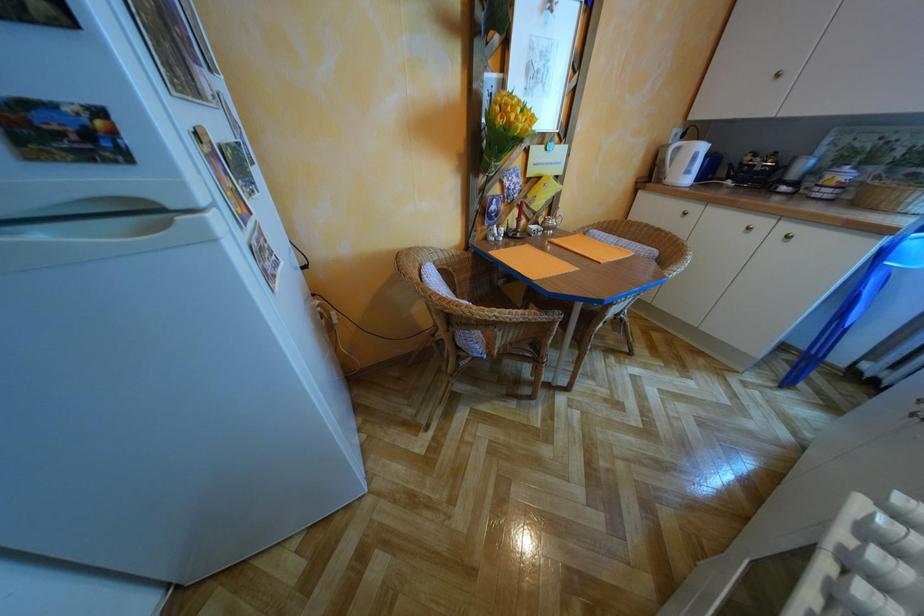
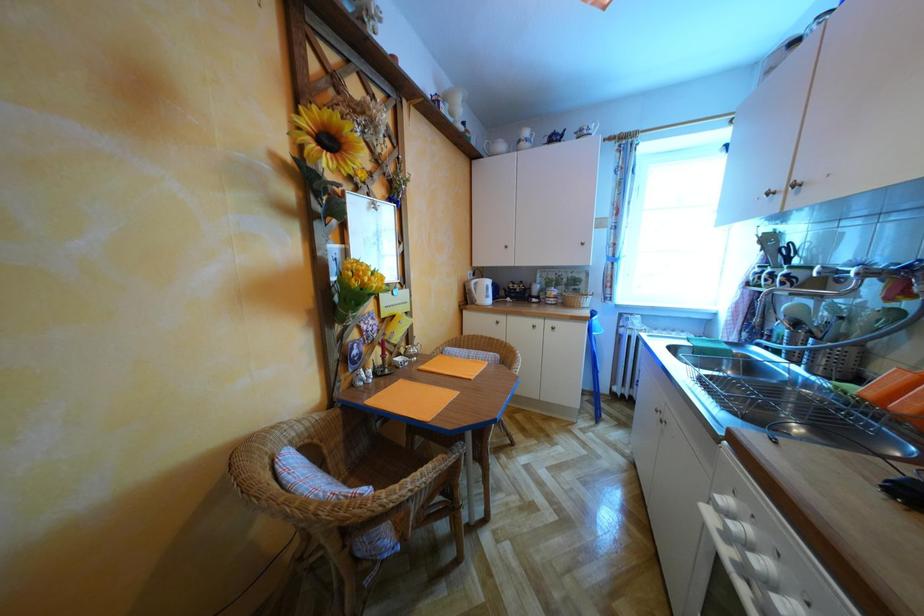
The first image is from the beginning of the video and the second image is from the end. How did the camera likely rotate when shooting the video?

The camera rotated toward right-up.